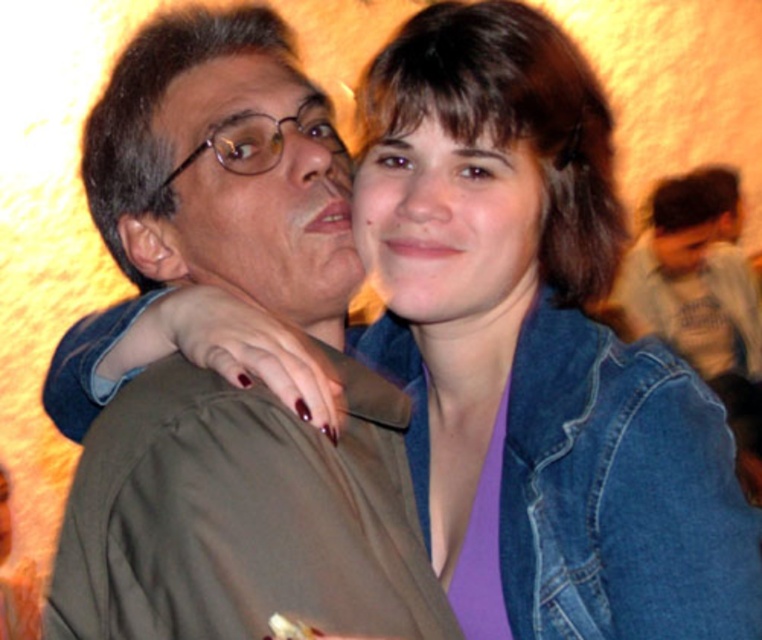
Question: Is light gray t-shirt at upper right smaller than matte brown hair at upper center?

Choices:
 (A) no
 (B) yes

Answer: (A)

Question: Does matte green jacket at center have a greater width compared to matte black face at upper right?

Choices:
 (A) no
 (B) yes

Answer: (B)

Question: Which of the following is the closest to the observer?

Choices:
 (A) matte green jacket at center
 (B) denim jacket at lower right
 (C) matte plastic glasses at upper left

Answer: (A)

Question: Which is nearer to the matte green jacket at center?

Choices:
 (A) matte brown face at center
 (B) matte brown hair at upper center

Answer: (A)

Question: Can you confirm if denim jacket at lower right is positioned to the left of matte brown hair at upper center?

Choices:
 (A) no
 (B) yes

Answer: (A)

Question: Which point appears closest to the camera in this image?

Choices:
 (A) (684, 344)
 (B) (415, 154)
 (C) (746, 595)

Answer: (C)